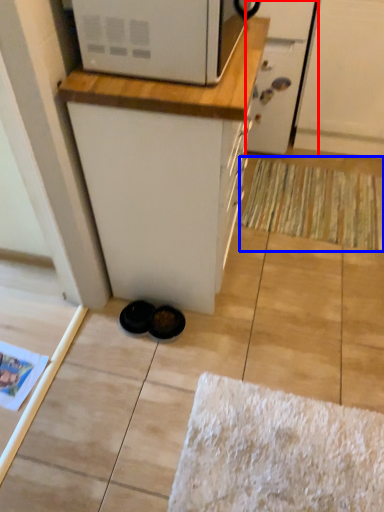
Question: Which point is further to the camera, screen door (highlighted by a red box) or doormat (highlighted by a blue box)?

Choices:
 (A) screen door
 (B) doormat

Answer: (B)